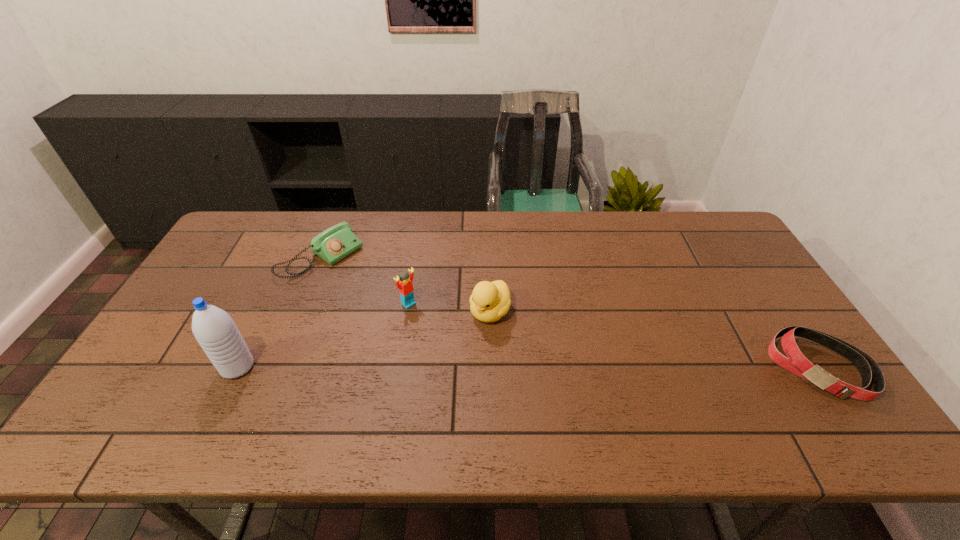
Locate an element on the screen. The height and width of the screenshot is (540, 960). water bottle is located at coordinates (214, 329).

Locate an element on the screen. Image resolution: width=960 pixels, height=540 pixels. the rightmost object is located at coordinates (795, 362).

Where is `Lego`? This screenshot has width=960, height=540. Lego is located at coordinates (405, 286).

This screenshot has width=960, height=540. In order to click on duck in this screenshot , I will do `click(490, 301)`.

Where is `the farthest object`? This screenshot has height=540, width=960. the farthest object is located at coordinates (337, 242).

This screenshot has height=540, width=960. I want to click on vacant space located on the right of the water bottle, so click(x=356, y=367).

At what (x,y) coordinates should I click in order to perform the action: click on free spot located 0.130m on the back of the dog collar. Please return your answer as a coordinate pair (x, y). The width and height of the screenshot is (960, 540). Looking at the image, I should click on (775, 301).

Where is `free region located 0.210m on the face of the third object from left to right`? free region located 0.210m on the face of the third object from left to right is located at coordinates (464, 350).

Locate an element on the screen. Image resolution: width=960 pixels, height=540 pixels. vacant area situated on the face of the third object from left to right is located at coordinates (456, 343).

Where is `free region located on the face of the third object from left to right`? The height and width of the screenshot is (540, 960). free region located on the face of the third object from left to right is located at coordinates click(434, 325).